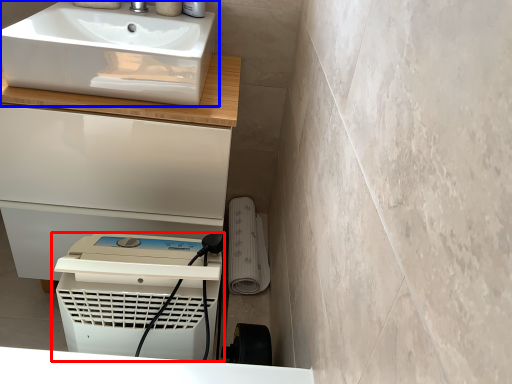
Question: Which object is further to the camera taking this photo, home appliance (highlighted by a red box) or sink (highlighted by a blue box)?

Choices:
 (A) home appliance
 (B) sink

Answer: (B)